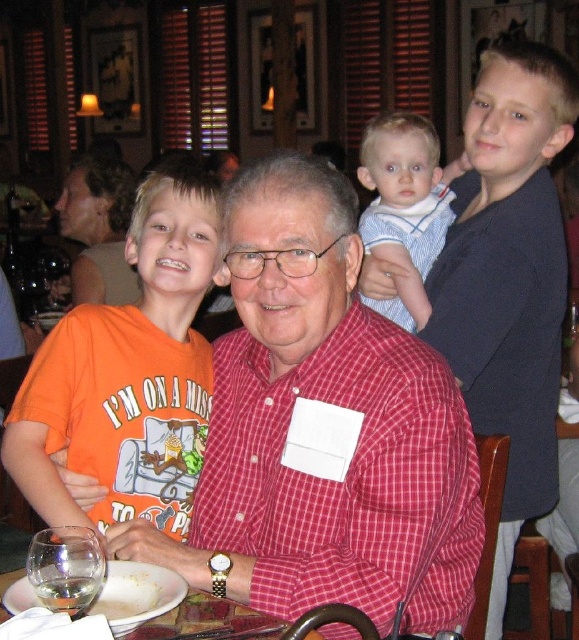
Question: Is orange cotton t-shirt at left closer to camera compared to clear glass table at center?

Choices:
 (A) yes
 (B) no

Answer: (B)

Question: Which object appears farthest from the camera in this image?

Choices:
 (A) orange cotton t-shirt at left
 (B) white matte plate at lower left
 (C) striped cotton shirt at upper center

Answer: (C)

Question: Can you confirm if striped cotton shirt at upper center is positioned below clear glass table at center?

Choices:
 (A) no
 (B) yes

Answer: (A)

Question: Based on their relative distances, which object is farther from the striped cotton shirt at upper center?

Choices:
 (A) white matte plate at lower left
 (B) orange cotton t-shirt at left
 (C) clear glass table at center

Answer: (C)

Question: Can you confirm if striped cotton shirt at upper center is bigger than clear glass table at center?

Choices:
 (A) no
 (B) yes

Answer: (B)

Question: Which point appears closest to the camera in this image?

Choices:
 (A) (1, 618)
 (B) (97, 554)
 (C) (20, 406)
 (D) (412, 291)

Answer: (B)